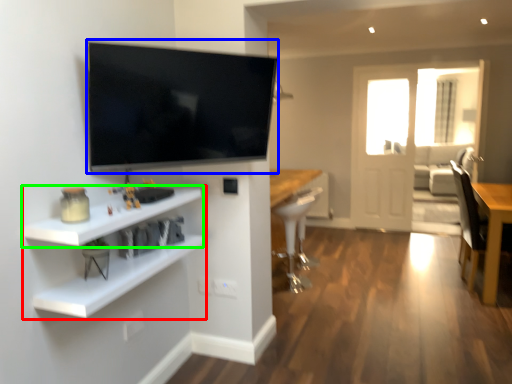
Question: Estimate the real-world distances between objects in this image. Which object is closer to shelf (highlighted by a red box), television (highlighted by a blue box) or shelf (highlighted by a green box)?

Choices:
 (A) television
 (B) shelf

Answer: (B)